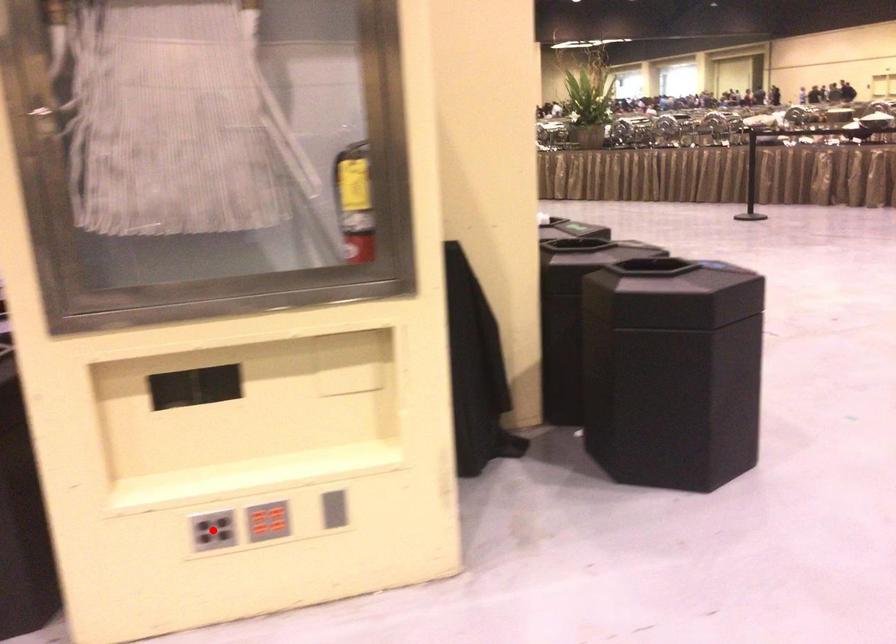
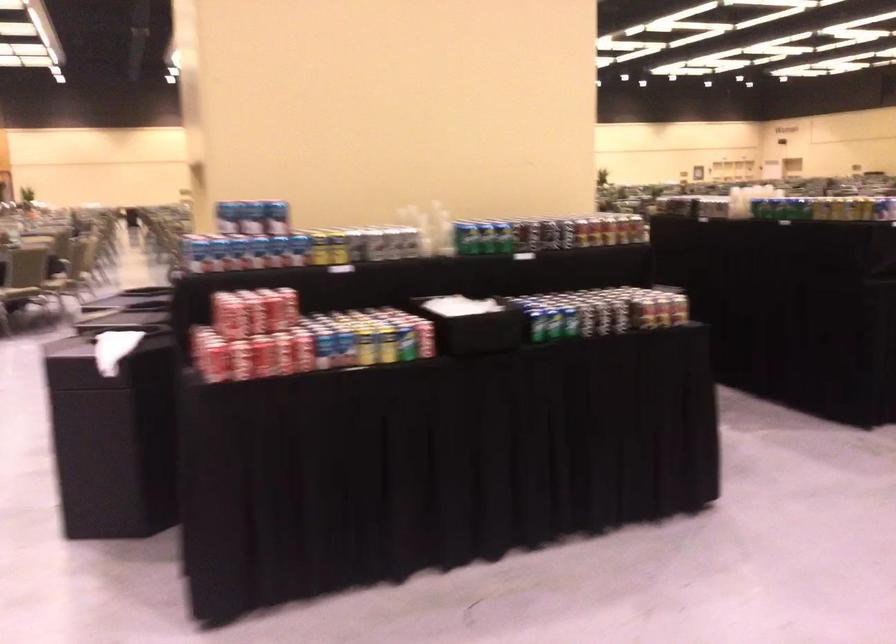
Question: I am providing you with two images of the same scene from different viewpoints. A red point is marked on the first image. Is the red point's position out of view in image 2?

Choices:
 (A) Yes
 (B) No

Answer: (A)